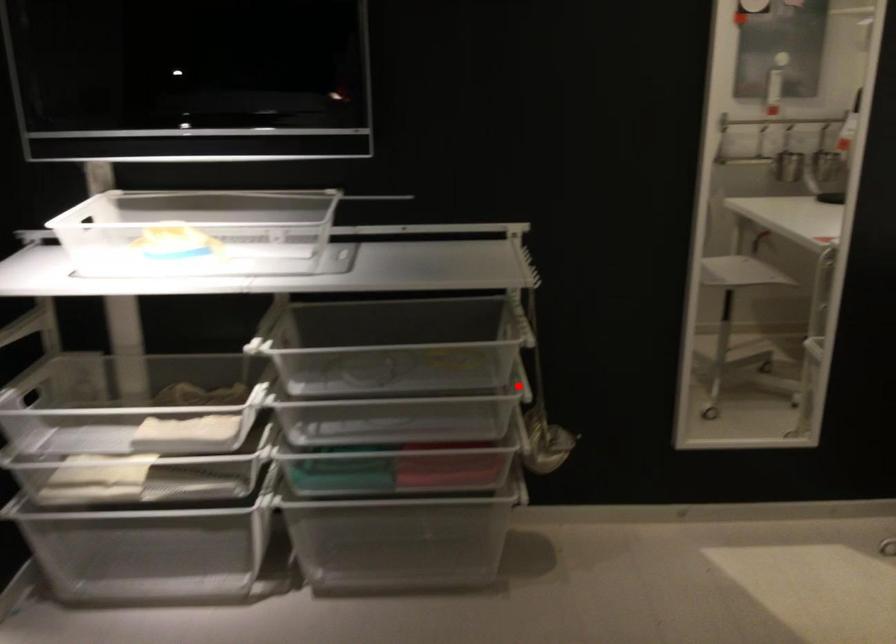
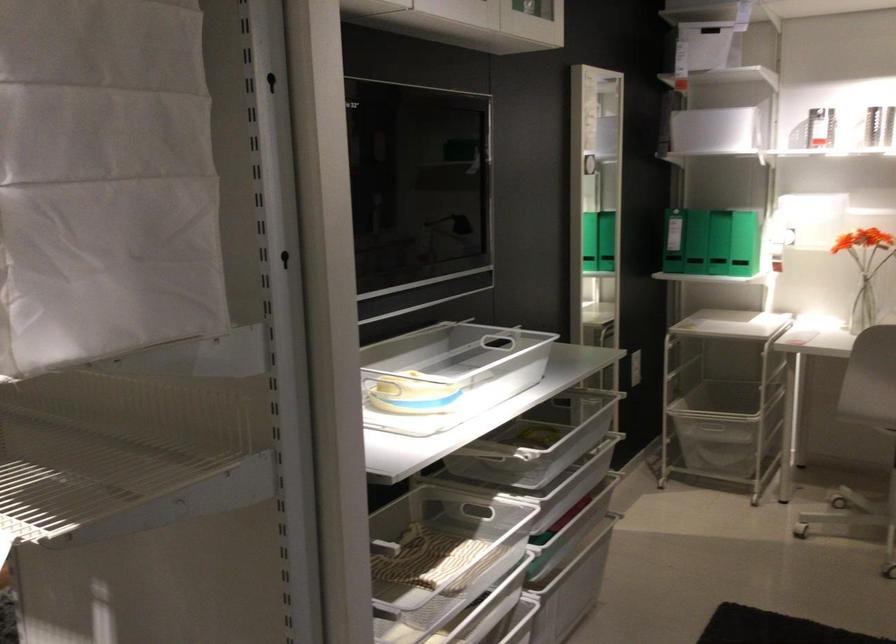
Question: I am providing you with two images of the same scene from different viewpoints. A red point is shown in image1. For the corresponding object point in image2, is it positioned nearer or farther from the camera?

Choices:
 (A) Nearer
 (B) Farther

Answer: (B)